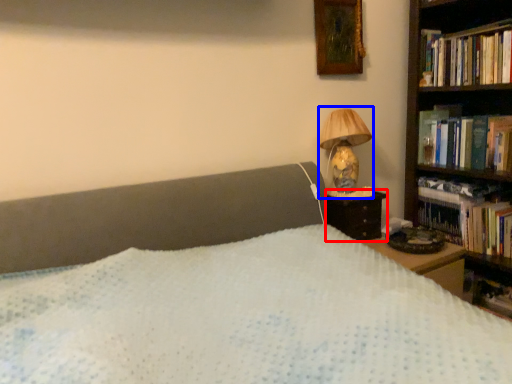
Question: Which object appears farthest to the camera in this image, nightstand (highlighted by a red box) or lamp (highlighted by a blue box)?

Choices:
 (A) nightstand
 (B) lamp

Answer: (A)